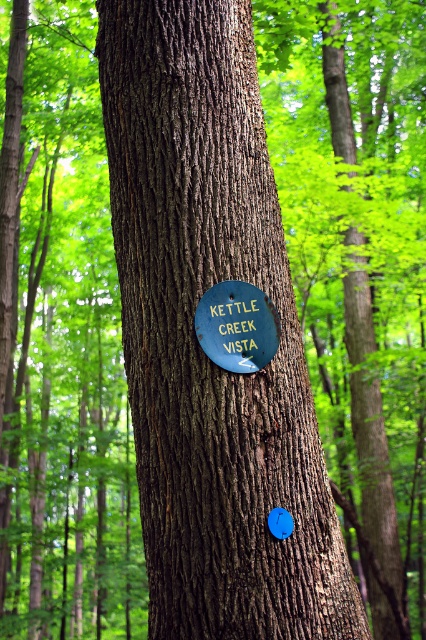
You are standing in a forest and want to reach a point that is 10 feet away from your current position. There is a point labeled as point (256,74) in the scene. Can you determine if this point is within your desired distance?

The distance of point (256,74) from viewer is 11.24 feet, which is slightly further than the desired 10 feet. Therefore, the point is just beyond your target distance.

You are a hiker trying to read the green matte sign at center while standing in front of the smooth brown bark at center. Can you see the entire sign clearly?

The smooth brown bark at center is in front of the green matte sign at center, so the bark may block part of the sign, making it difficult to see the entire sign clearly.

You are a hiker trying to read the green matte sign at center attached to the smooth brown bark at center. Can you easily read the sign without needing to look up or down?

The smooth brown bark at center is much taller than the green matte sign at center, so the sign is positioned lower on the bark. Therefore, you might need to look down slightly to read the green matte sign at center.